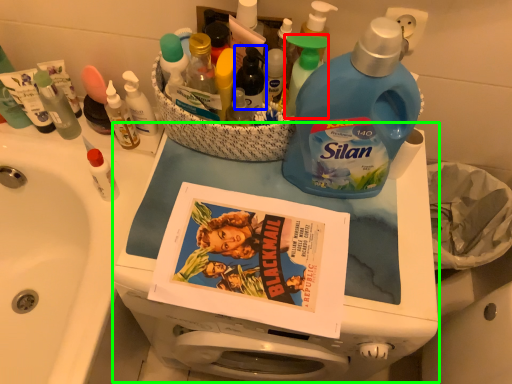
Question: Which is farther away from cleaning product (highlighted by a red box)? bottle (highlighted by a blue box) or appliance (highlighted by a green box)?

Choices:
 (A) bottle
 (B) appliance

Answer: (B)